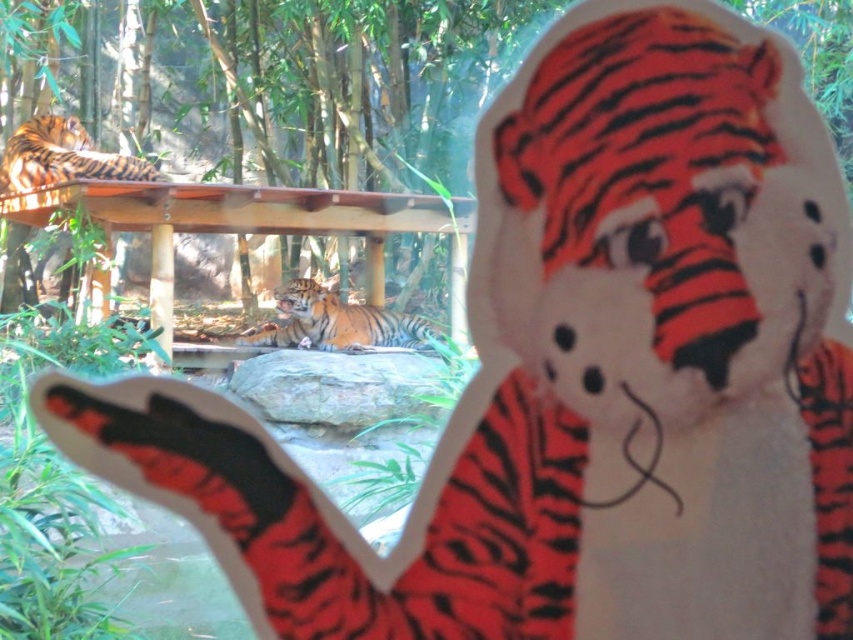
Question: Which object is farther from the camera taking this photo?

Choices:
 (A) orange striped tiger at upper left
 (B) orange striped tiger at center

Answer: (B)

Question: Can you confirm if orange striped tiger at center is positioned above orange striped tiger at upper left?

Choices:
 (A) yes
 (B) no

Answer: (B)

Question: Which of the following is the closest to the observer?

Choices:
 (A) (405, 314)
 (B) (109, 170)

Answer: (B)

Question: Is orange striped tiger at center further to the viewer compared to orange striped tiger at upper left?

Choices:
 (A) yes
 (B) no

Answer: (A)

Question: Is orange striped tiger at center thinner than orange striped tiger at upper left?

Choices:
 (A) no
 (B) yes

Answer: (A)

Question: Which point is closer to the camera?

Choices:
 (A) (372, 320)
 (B) (39, 129)

Answer: (A)